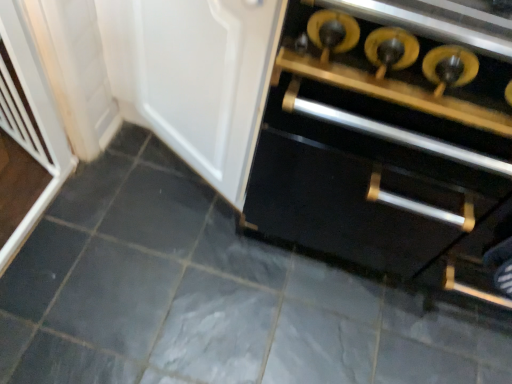
Question: From a real-world perspective, is black matte cabinet at center positioned above or below matte white door at center?

Choices:
 (A) above
 (B) below

Answer: (B)

Question: Would you say black matte cabinet at center is inside or outside matte white door at center?

Choices:
 (A) outside
 (B) inside

Answer: (A)

Question: Considering the real-world distances, which object is farthest from the matte white door at center?

Choices:
 (A) white plastic screen door at left
 (B) black matte cabinet at center
 (C) gray matte tile at center

Answer: (C)

Question: Considering the real-world distances, which object is farthest from the white plastic screen door at left?

Choices:
 (A) gray matte tile at center
 (B) matte white door at center
 (C) black matte cabinet at center

Answer: (C)